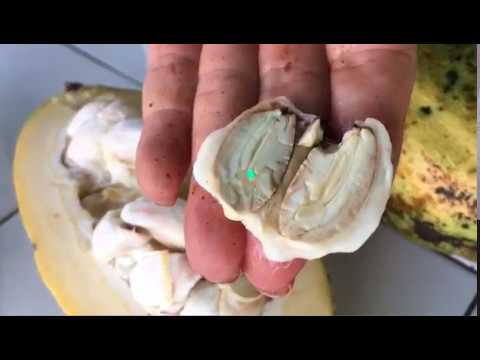
Where is `line on table surface`? Image resolution: width=480 pixels, height=360 pixels. line on table surface is located at coordinates (470, 304), (461, 265), (86, 58), (9, 217).